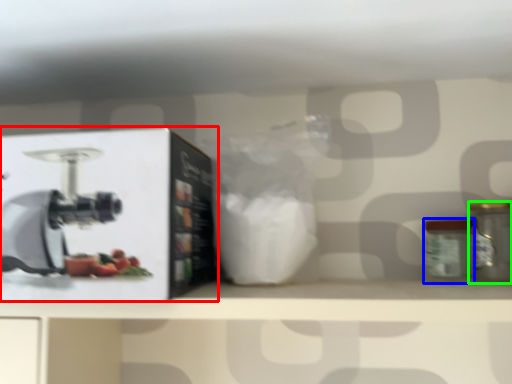
Question: Which object is positioned farthest from wide (highlighted by a red box)? Select from glass jar (highlighted by a blue box) and kitchen appliance (highlighted by a green box).

Choices:
 (A) glass jar
 (B) kitchen appliance

Answer: (B)